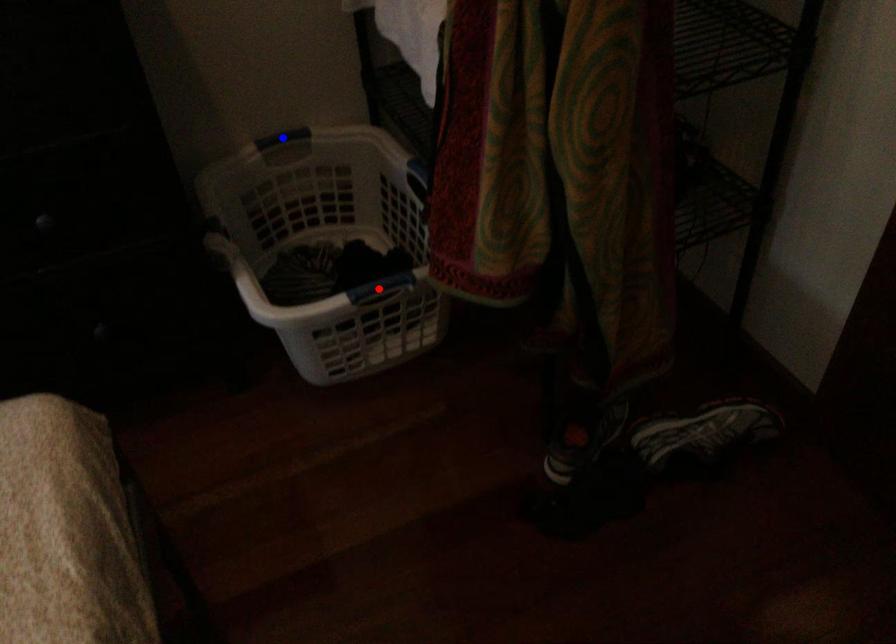
Question: Which of the two points in the image is closer to the camera?

Choices:
 (A) Blue point is closer.
 (B) Red point is closer.

Answer: (B)